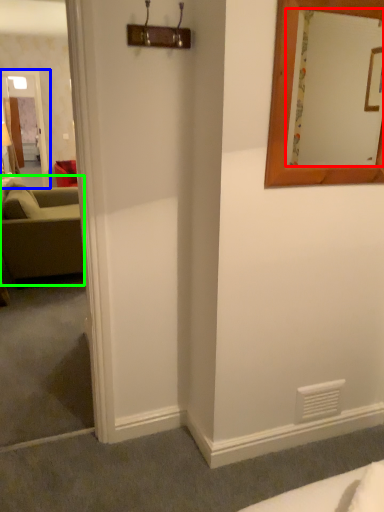
Question: Based on their relative distances, which object is farther from mirror (highlighted by a red box)? Choose from glass door (highlighted by a blue box) and studio couch (highlighted by a green box).

Choices:
 (A) glass door
 (B) studio couch

Answer: (A)